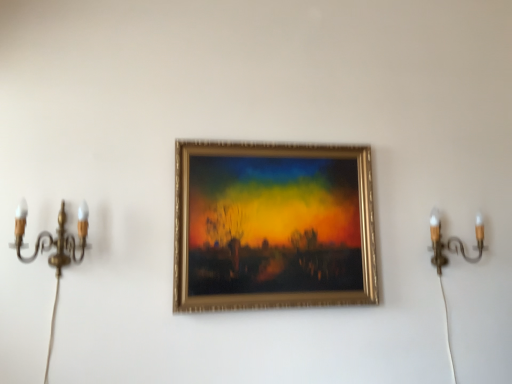
Question: Is gold metallic picture frame at center in front of gold brass candle holder at left, the second candle holder positioned from the back?

Choices:
 (A) yes
 (B) no

Answer: (B)

Question: From a real-world perspective, is gold metallic picture frame at center located beneath gold brass candle holder at left, arranged as the 1th candle holder when viewed from the left?

Choices:
 (A) no
 (B) yes

Answer: (A)

Question: Is gold metallic picture frame at center facing away from gold brass candle holder at left, arranged as the 1th candle holder when viewed from the left?

Choices:
 (A) yes
 (B) no

Answer: (B)

Question: Are gold metallic picture frame at center and gold brass candle holder at left, arranged as the 1th candle holder when viewed from the left, located far from each other?

Choices:
 (A) no
 (B) yes

Answer: (A)

Question: Considering the relative sizes of gold metallic picture frame at center and gold brass candle holder at left, which is counted as the first candle holder, starting from the front, in the image provided, is gold metallic picture frame at center bigger than gold brass candle holder at left, which is counted as the first candle holder, starting from the front,?

Choices:
 (A) yes
 (B) no

Answer: (A)

Question: Based on their positions, is gold metallic candle holder at right, the second candle holder when ordered from left to right, located to the left or right of gold metallic picture frame at center?

Choices:
 (A) right
 (B) left

Answer: (A)

Question: Is gold metallic candle holder at right, the second candle holder when ordered from left to right, in front of or behind gold metallic picture frame at center in the image?

Choices:
 (A) behind
 (B) front

Answer: (A)

Question: From a real-world perspective, is gold metallic candle holder at right, marked as the first candle holder in a back-to-front arrangement, positioned above or below gold metallic picture frame at center?

Choices:
 (A) above
 (B) below

Answer: (B)

Question: In terms of width, does gold metallic candle holder at right, which is the 1th candle holder from right to left, look wider or thinner when compared to gold metallic picture frame at center?

Choices:
 (A) thin
 (B) wide

Answer: (B)

Question: Looking at their shapes, would you say gold metallic picture frame at center is wider or thinner than gold brass candle holder at left, arranged as the 1th candle holder when viewed from the left?

Choices:
 (A) thin
 (B) wide

Answer: (A)

Question: In terms of height, does gold metallic picture frame at center look taller or shorter compared to gold brass candle holder at left, the second candle holder positioned from the back?

Choices:
 (A) tall
 (B) short

Answer: (A)

Question: From the image's perspective, is gold metallic picture frame at center positioned above or below gold brass candle holder at left, the second candle holder positioned from the back?

Choices:
 (A) below
 (B) above

Answer: (B)

Question: Does point (335, 231) appear closer or farther from the camera than point (17, 233)?

Choices:
 (A) closer
 (B) farther

Answer: (B)

Question: Would you say gold brass candle holder at left, placed as the second candle holder when sorted from right to left, is to the left or to the right of gold metallic candle holder at right, the 2th candle holder viewed from the front, in the picture?

Choices:
 (A) right
 (B) left

Answer: (B)

Question: Considering the positions of gold brass candle holder at left, the second candle holder positioned from the back, and gold metallic candle holder at right, the second candle holder when ordered from left to right, in the image, is gold brass candle holder at left, the second candle holder positioned from the back, taller or shorter than gold metallic candle holder at right, the second candle holder when ordered from left to right,?

Choices:
 (A) short
 (B) tall

Answer: (A)